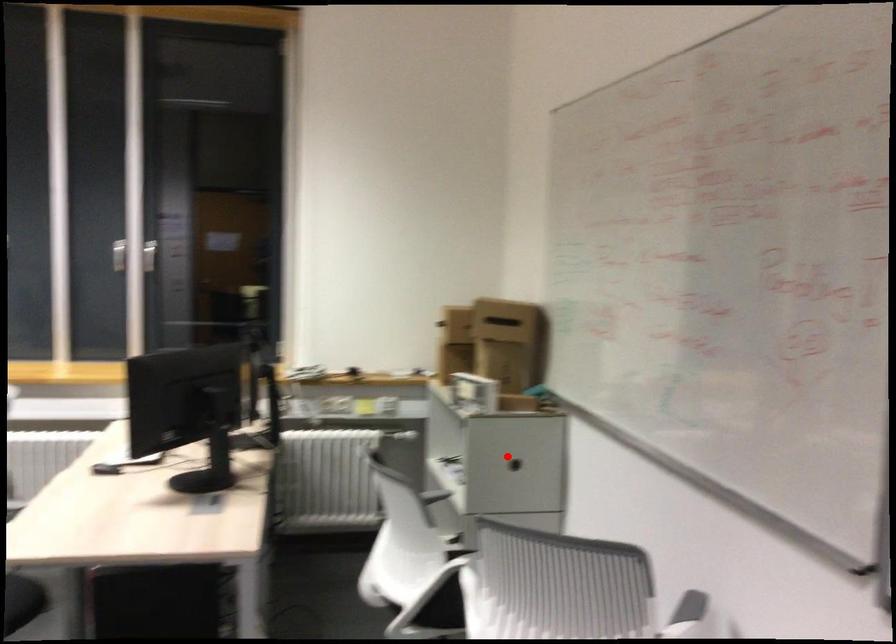
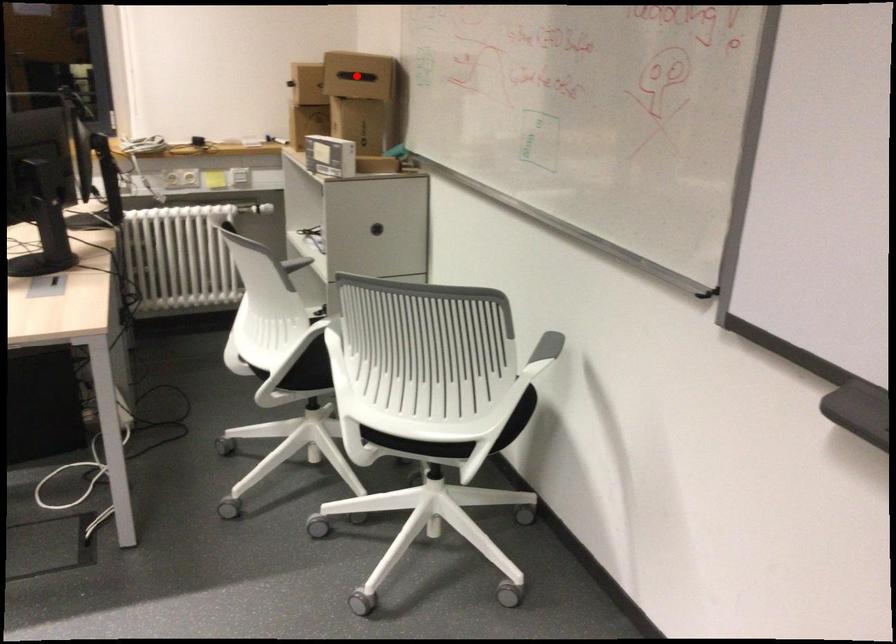
I am providing you with two images of the same scene from different viewpoints. A red point is marked on the first image and another point is marked on the second image. Is the red point in image1 aligned with the point shown in image2?

No